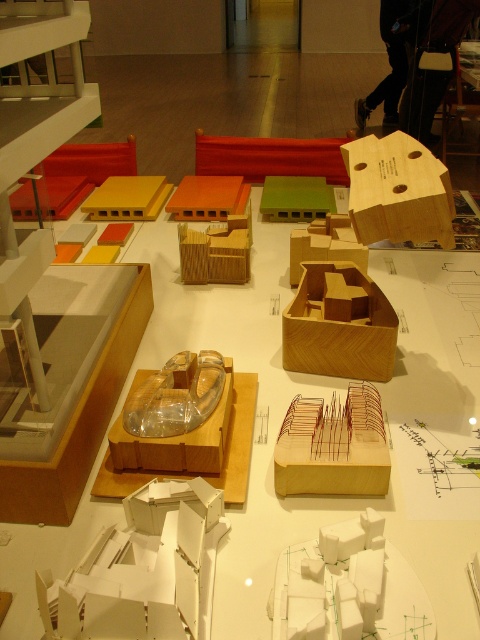
You are standing in front of an architectural exhibition and see two points marked on the display. The first point is at coordinate point (239,534) and the second is at point (326,243). Which point is closer to you?

Point (239,534) is closer to the viewer than point (326,243).

You are standing in front of the architectural models and need to reach both the wooden model at center and the wooden cube at center. Which object will you encounter first as you move forward?

The wooden model at center will be encountered first because it is closer to the viewer than the wooden cube at center.